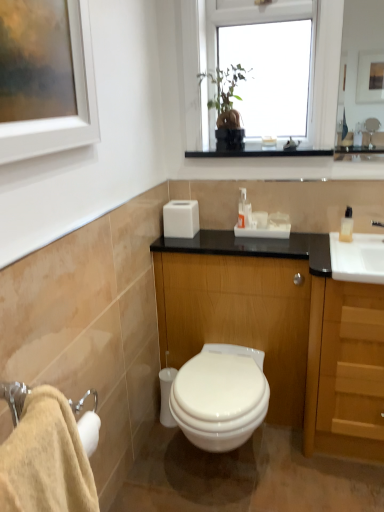
Question: Is wooden cabinet at center to the left or to the right of white glossy toilet at center in the image?

Choices:
 (A) left
 (B) right

Answer: (B)

Question: In terms of width, does wooden cabinet at center look wider or thinner when compared to white glossy toilet at center?

Choices:
 (A) thin
 (B) wide

Answer: (A)

Question: Considering the real-world distances, which object is farthest from the clear plastic soap dispenser at right?

Choices:
 (A) white glossy toilet at center
 (B) light wood/wooden cabinet at right
 (C) transparent glass window at upper center
 (D) beige cotton bath towel at lower left
 (E) wooden cabinet at center

Answer: (D)

Question: Which object is positioned closest to the white glossy toilet at center?

Choices:
 (A) light wood/wooden cabinet at right
 (B) wooden cabinet at center
 (C) transparent glass window at upper center
 (D) white plastic soap dispenser at center
 (E) beige cotton bath towel at lower left

Answer: (B)